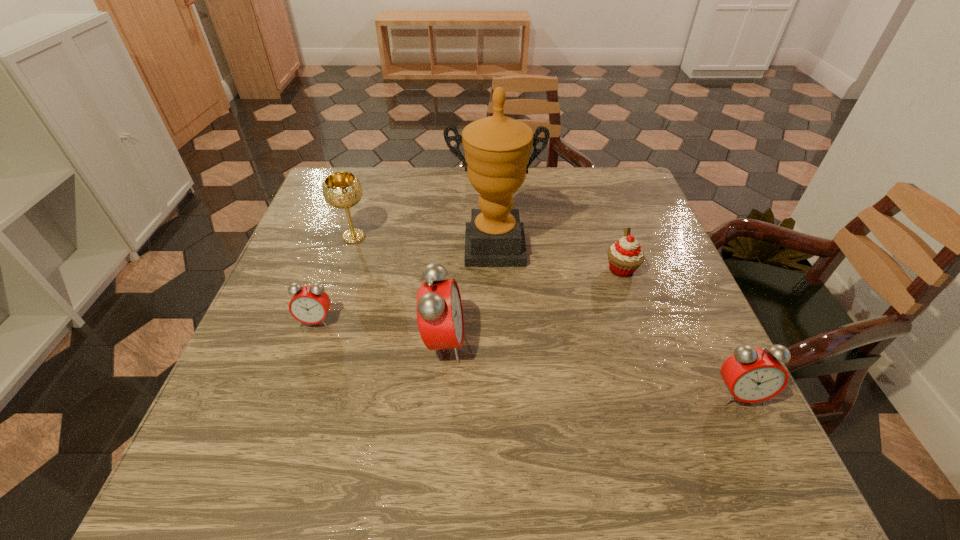
The height and width of the screenshot is (540, 960). Identify the location of vacant space in between the cupcake and the second alarm clock from left to right. (533, 306).

Locate an element on the screen. free space that is in between the second alarm clock from right to left and the chalice is located at coordinates (399, 289).

Locate an element on the screen. Image resolution: width=960 pixels, height=540 pixels. free spot between the leftmost alarm clock and the tallest object is located at coordinates (405, 284).

This screenshot has width=960, height=540. I want to click on free area in between the award and the tallest alarm clock, so click(x=468, y=295).

Identify which object is the fourth closest to the shortest alarm clock. Please provide its 2D coordinates. Your answer should be formatted as a tuple, i.e. [(x, y)], where the tuple contains the x and y coordinates of a point satisfying the conditions above.

[(625, 256)]

Find the location of a particular element. The height and width of the screenshot is (540, 960). the closest object relative to the cupcake is located at coordinates (497, 149).

Identify the location of alarm clock that can be found as the second closest to the fifth object from left to right. This screenshot has width=960, height=540. (439, 309).

Identify the location of the closest alarm clock to the rightmost object. (439, 309).

Identify the location of free location that satisfies the following two spatial constraints: 1. at the front of the award with handles; 2. on the front-facing side of the second alarm clock from left to right. This screenshot has width=960, height=540. [x=496, y=342].

Locate an element on the screen. The height and width of the screenshot is (540, 960). blank space that satisfies the following two spatial constraints: 1. at the front of the second object from right to left with handles; 2. on the right side of the award is located at coordinates (494, 269).